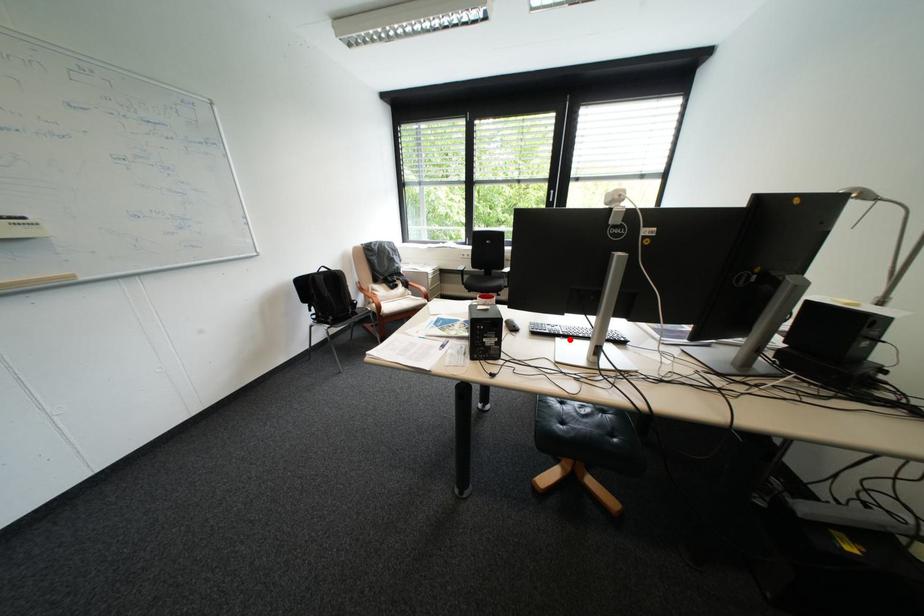
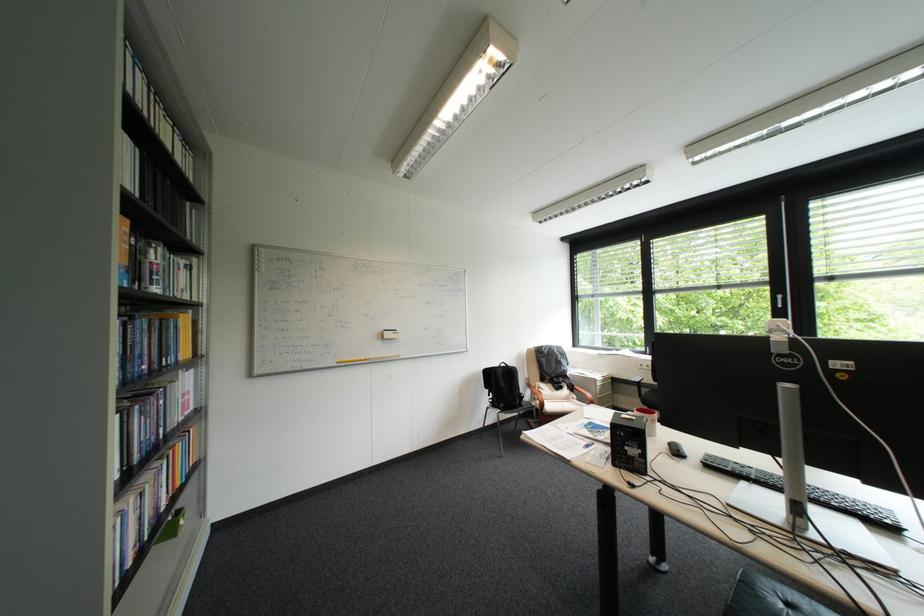
Find the pixel in the second image that matches the highlighted location in the first image.

(757, 484)